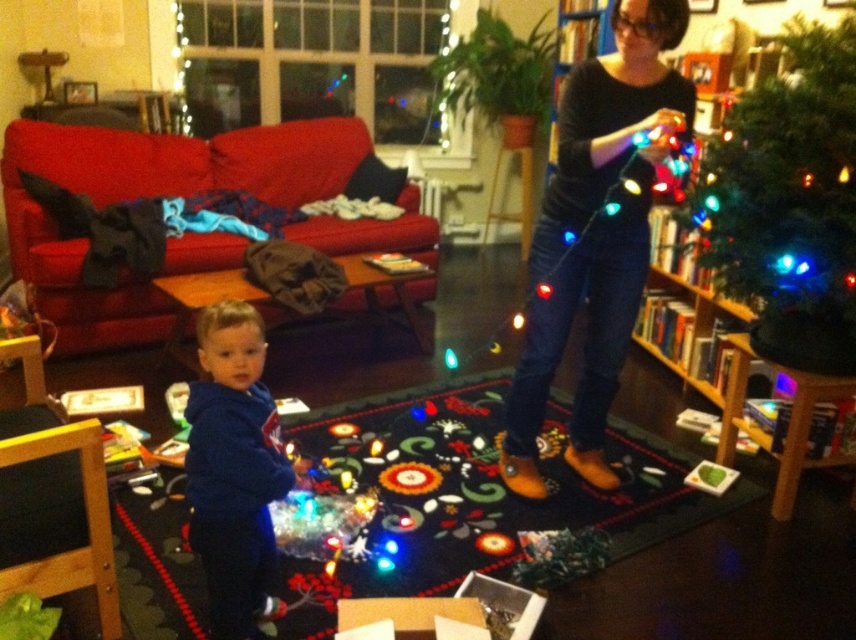
You are a parent trying to store the black leather boots at center and the green matte christmas tree at upper right. Given their sizes, which object would require more storage space?

The black leather boots at center is larger in size than the green matte christmas tree at upper right, so the black leather boots at center would require more storage space.

You are a delivery robot that is 2 feet wide. You need to move from the black leather boots at center to the blue fleece hoodie at lower left. Is there enough space for you to navigate between these two items?

Result: The distance between the black leather boots at center and the blue fleece hoodie at lower left is 3.29 feet, which is wider than the robot width of 2 feet. Therefore, the robot can navigate between them.

You are a delivery robot positioned at the entrance of the living room. Your goal is to deliver a package to the point marked as point (626, 22). However, there is an obstacle at point (201, 440). Can you reach the delivery point without moving around the obstacle?

Point (626, 22) is behind point (201, 440), so the obstacle at point (201, 440) is blocking the direct path to the delivery point. You will need to move around the obstacle to reach the delivery point.